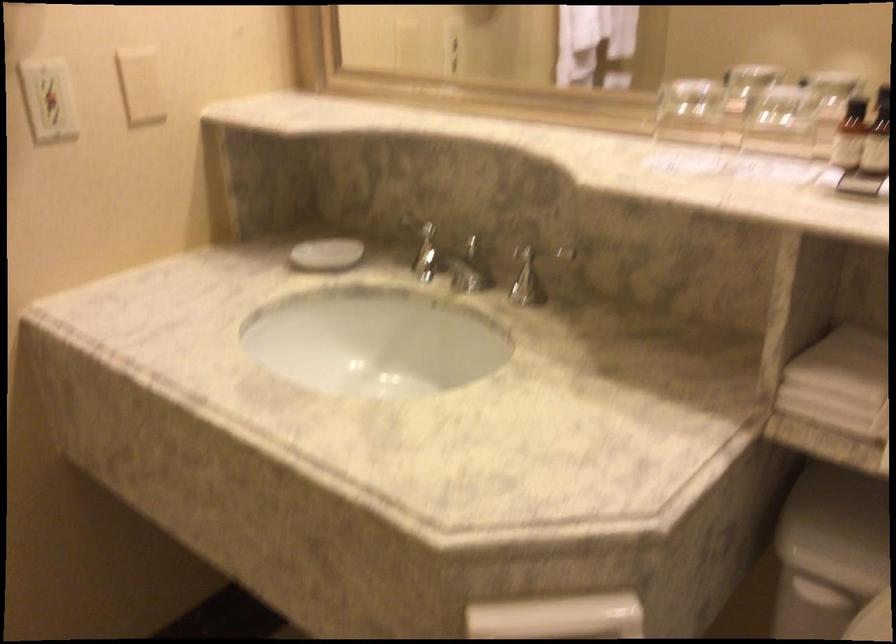
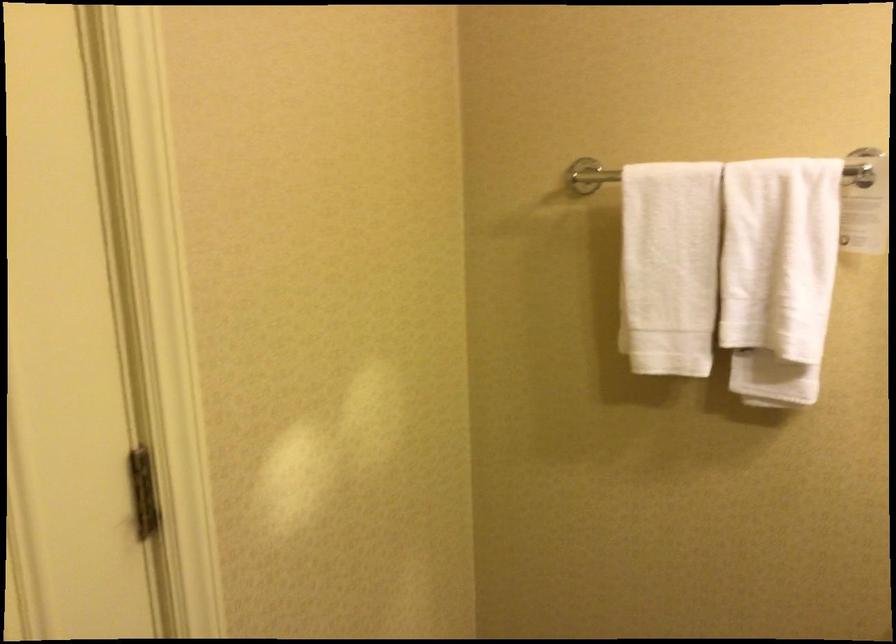
Question: Based on the continuous images, in which direction is the camera rotating? Reply with the corresponding letter.

Choices:
 (A) Left
 (B) Right
 (C) Up
 (D) Down

Answer: (A)